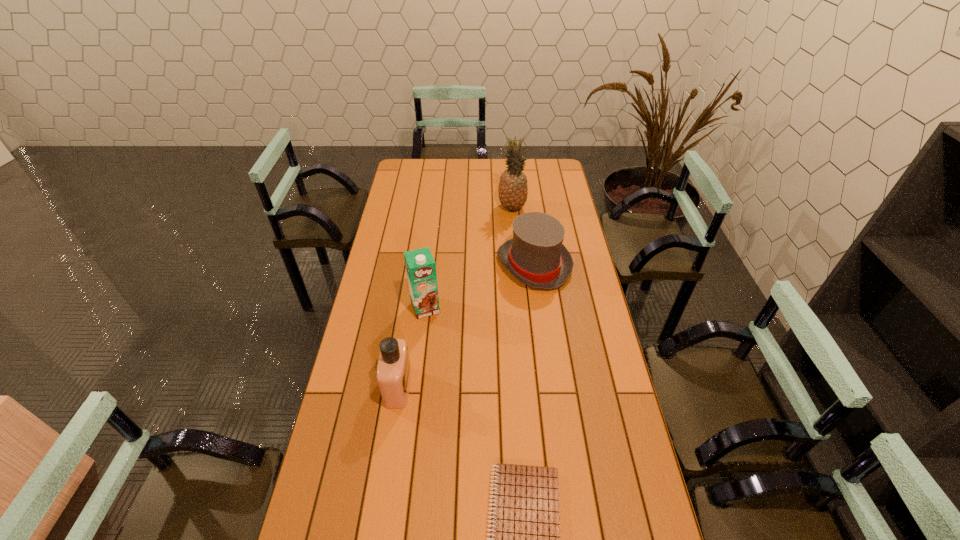
I want to click on object that is the second nearest to the shortest object, so click(x=420, y=265).

What are the coordinates of `free location that satisfies the following two spatial constraints: 1. on the front side of the tallest object; 2. on the front label of the perfume` in the screenshot? It's located at (528, 387).

You are a GUI agent. You are given a task and a screenshot of the screen. Output one action in this format:
    pyautogui.click(x=<x>, y=<y>)
    Task: Click on the free location that satisfies the following two spatial constraints: 1. on the front side of the third farthest object; 2. on the front label of the perfume
    The width and height of the screenshot is (960, 540).
    Given the screenshot: What is the action you would take?
    pyautogui.click(x=416, y=387)